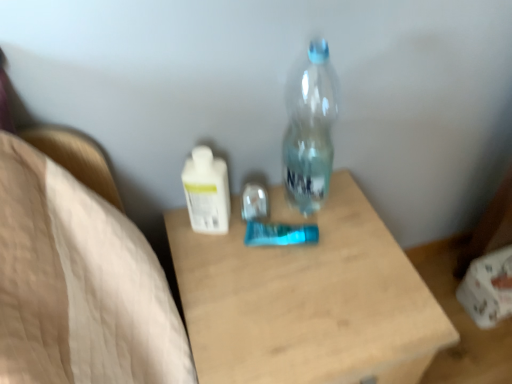
The width and height of the screenshot is (512, 384). Find the location of `vacant space to the right of white glossy lotion at center, the 1th bottle viewed from the left`. vacant space to the right of white glossy lotion at center, the 1th bottle viewed from the left is located at coordinates (312, 237).